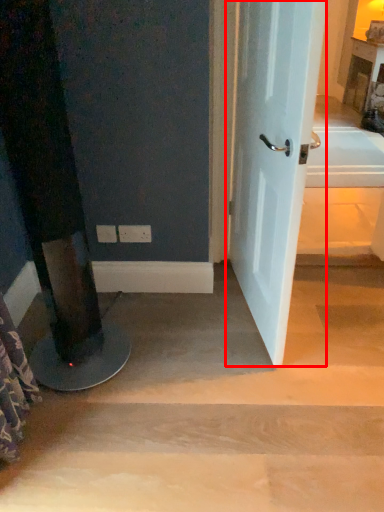
Question: From the image's perspective, considering the relative positions of door (annotated by the red box) and stairwell in the image provided, where is door (annotated by the red box) located with respect to the staircase?

Choices:
 (A) below
 (B) above

Answer: (B)